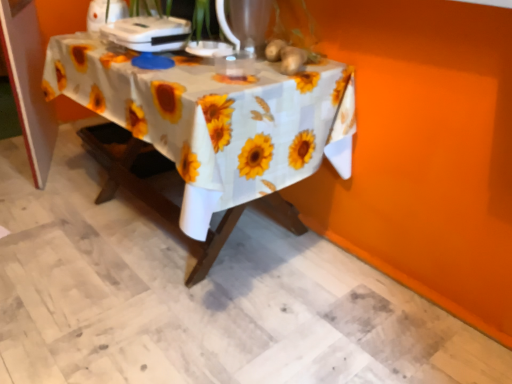
Question: Which direction should I rotate to face yellow matte sunflower at upper center, the 2th flower from the front, — up or down?

Choices:
 (A) up
 (B) down

Answer: (A)

Question: Can you confirm if yellow matte sunflower at upper center, the 2th flower from the front, is positioned to the left of white plastic appliance at upper center, arranged as the second appliance when viewed from the left?

Choices:
 (A) no
 (B) yes

Answer: (A)

Question: From the image's perspective, is yellow matte sunflower at upper center, the first flower from the back, located beneath white plastic appliance at upper center, arranged as the second appliance when viewed from the left?

Choices:
 (A) yes
 (B) no

Answer: (A)

Question: Can you confirm if yellow matte sunflower at upper center, the 2th flower from the front, is taller than white plastic appliance at upper center, arranged as the second appliance when viewed from the left?

Choices:
 (A) yes
 (B) no

Answer: (B)

Question: Is yellow matte sunflower at upper center, the 2th flower from the front, wider than white plastic appliance at upper center, placed as the 1th appliance when sorted from right to left?

Choices:
 (A) no
 (B) yes

Answer: (A)

Question: From a real-world perspective, is yellow matte sunflower at upper center, the 2th flower from the front, under white plastic appliance at upper center, arranged as the second appliance when viewed from the left?

Choices:
 (A) no
 (B) yes

Answer: (B)

Question: Can you confirm if yellow matte sunflower at upper center, the first flower from the back, is shorter than white plastic appliance at upper center, placed as the 1th appliance when sorted from right to left?

Choices:
 (A) no
 (B) yes

Answer: (B)

Question: From a real-world perspective, does white plastic appliance at upper center, which is counted as the 2th appliance, starting from the right, sit lower than white plastic appliance at upper center, arranged as the second appliance when viewed from the left?

Choices:
 (A) yes
 (B) no

Answer: (B)

Question: Is white plastic appliance at upper center, which is the 1th appliance in left-to-right order, further to camera compared to white plastic appliance at upper center, placed as the 1th appliance when sorted from right to left?

Choices:
 (A) no
 (B) yes

Answer: (B)

Question: From the image's perspective, does white plastic appliance at upper center, which is counted as the 2th appliance, starting from the right, appear lower than white plastic appliance at upper center, placed as the 1th appliance when sorted from right to left?

Choices:
 (A) yes
 (B) no

Answer: (B)

Question: Is white plastic appliance at upper center, which is counted as the 2th appliance, starting from the right, to the left of white plastic appliance at upper center, placed as the 1th appliance when sorted from right to left, from the viewer's perspective?

Choices:
 (A) yes
 (B) no

Answer: (A)

Question: Is white plastic appliance at upper center, which is counted as the 2th appliance, starting from the right, closer to the viewer compared to white plastic appliance at upper center, placed as the 1th appliance when sorted from right to left?

Choices:
 (A) yes
 (B) no

Answer: (B)

Question: Is white plastic appliance at upper center, which is counted as the 2th appliance, starting from the right, completely or partially outside of white plastic appliance at upper center, arranged as the second appliance when viewed from the left?

Choices:
 (A) yes
 (B) no

Answer: (A)

Question: Is yellow matte sunflower at upper center, the 1th flower from the front, located outside yellow matte sunflower at upper center, the 2th flower from the front?

Choices:
 (A) yes
 (B) no

Answer: (A)